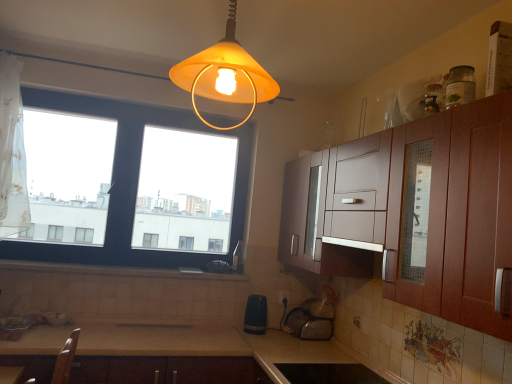
Question: Is white tile at lower center wider or thinner than metallic silver sink at lower center, positioned as the 1th appliance in back-to-front order?

Choices:
 (A) thin
 (B) wide

Answer: (A)

Question: From a real-world perspective, relative to metallic silver sink at lower center, positioned as the 1th appliance in back-to-front order, is white tile at lower center vertically above or below?

Choices:
 (A) above
 (B) below

Answer: (A)

Question: Estimate the real-world distances between objects in this image. Which object is closer to the white tile at lower center?

Choices:
 (A) black plastic toaster at lower center, placed as the third appliance when sorted from bottom to top
 (B) metallic silver sink at lower center, which appears as the 3th appliance when viewed from the top
 (C) transparent glass window at left
 (D) clear glass jar at upper right, which is the 1th appliance in front-to-back order
 (E) black matte stove at lower center, which ranks as the third appliance in back-to-front order

Answer: (C)

Question: Which object is positioned closest to the white tile at lower center?

Choices:
 (A) black matte stove at lower center, which ranks as the third appliance in back-to-front order
 (B) clear glass jar at upper right, which is the 1th appliance in front-to-back order
 (C) beige laminate countertop at lower center
 (D) metallic silver sink at lower center, which appears as the 3th appliance when viewed from the top
 (E) black plastic toaster at lower center, placed as the third appliance when sorted from bottom to top

Answer: (E)